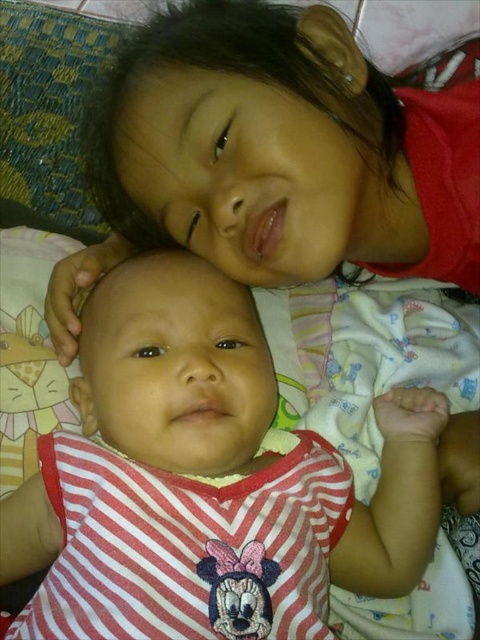
You are a photographer trying to capture a closeup of the baby in the foreground. The red striped fabric at center and the matte red shirt at upper center are both in the frame. Which object is closer to the camera?

The red striped fabric at center is closer to the camera because it is positioned below the matte red shirt at upper center, meaning it is lower in the frame and thus nearer to the viewer.

You are a photographer trying to capture a closeup of the baby in the foreground. The red striped fabric at center and the matte red shirt at upper center are both in the frame. Which object is narrower so that it won

The red striped fabric at center is narrower than the matte red shirt at upper center, so it is the narrower object in the frame.